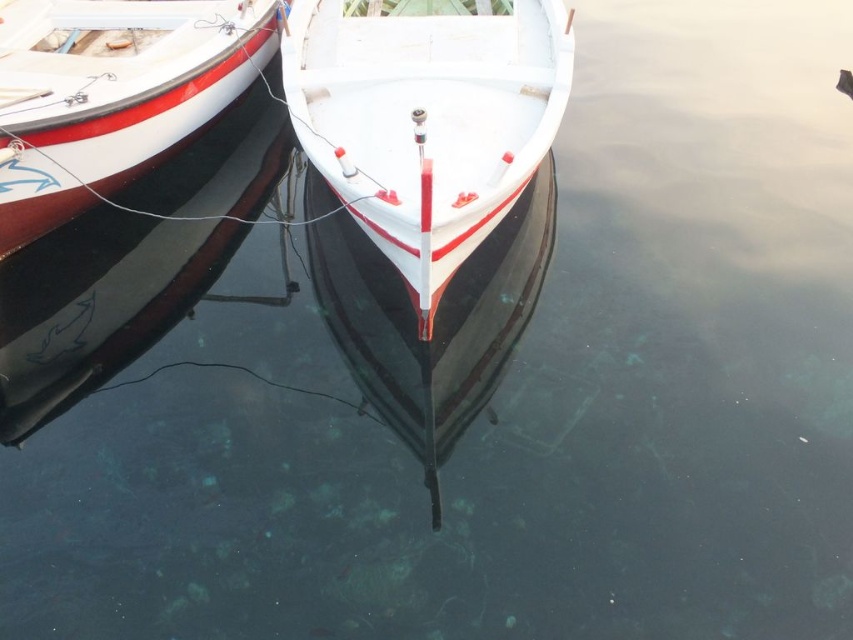
Question: Considering the relative positions of white matte boat at center and white glossy boat at center in the image provided, where is white matte boat at center located with respect to white glossy boat at center?

Choices:
 (A) above
 (B) below

Answer: (B)

Question: Does white matte boat at center appear on the right side of white glossy boat at center?

Choices:
 (A) yes
 (B) no

Answer: (A)

Question: Which of the following is the farthest from the observer?

Choices:
 (A) white matte boat at center
 (B) white glossy boat at center

Answer: (B)

Question: Which of the following is the farthest from the observer?

Choices:
 (A) white matte boat at center
 (B) white glossy boat at center

Answer: (B)

Question: Observing the image, what is the correct spatial positioning of white matte boat at center in reference to white glossy boat at center?

Choices:
 (A) below
 (B) above

Answer: (A)

Question: Among these objects, which one is farthest from the camera?

Choices:
 (A) white matte boat at center
 (B) white glossy boat at center

Answer: (B)